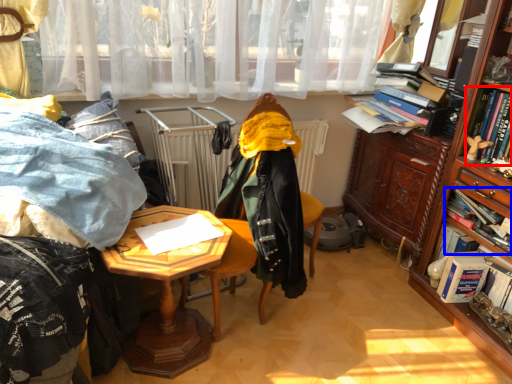
Question: Which object is further to the camera taking this photo, book (highlighted by a red box) or book (highlighted by a blue box)?

Choices:
 (A) book
 (B) book

Answer: (B)